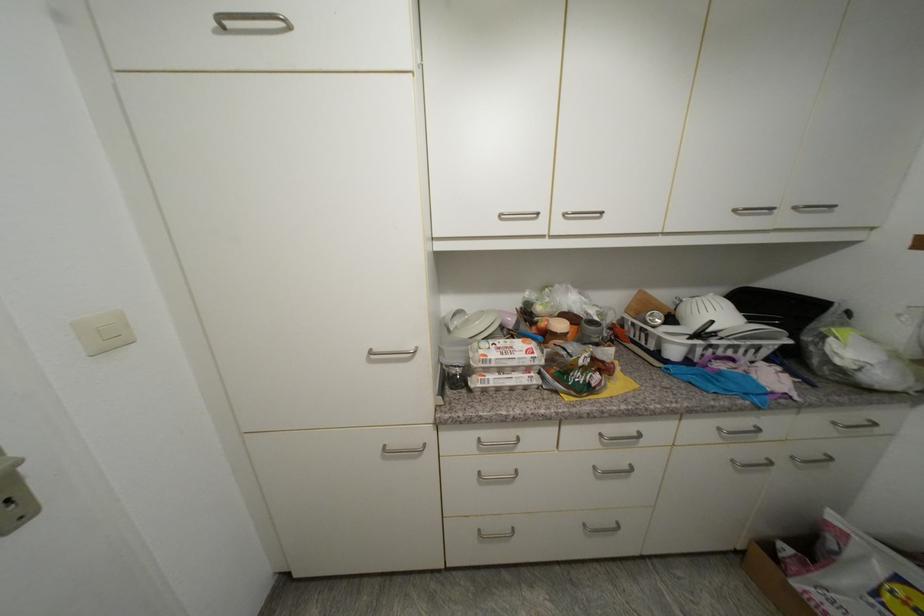
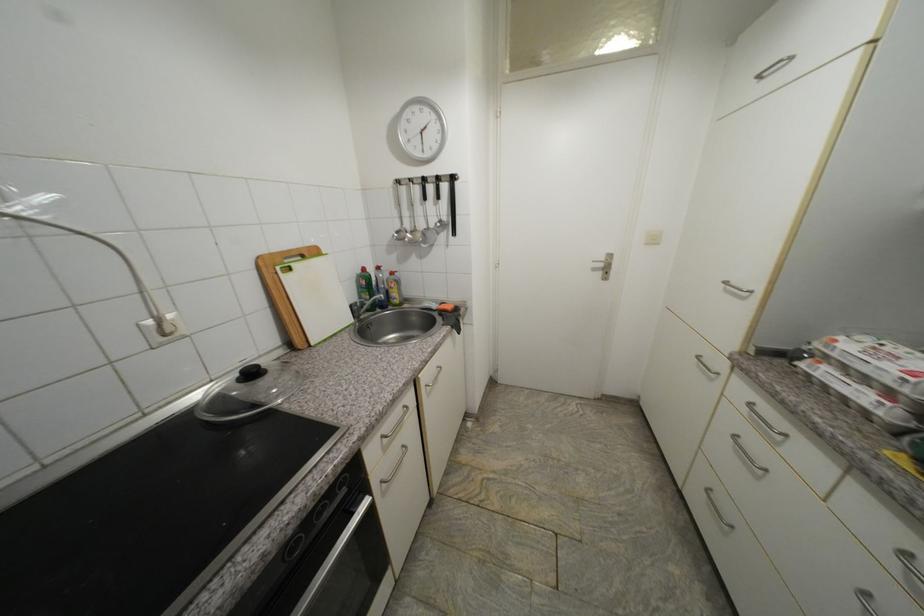
Based on the continuous images, in which direction is the camera rotating?

The rotation direction of the camera is left-down.